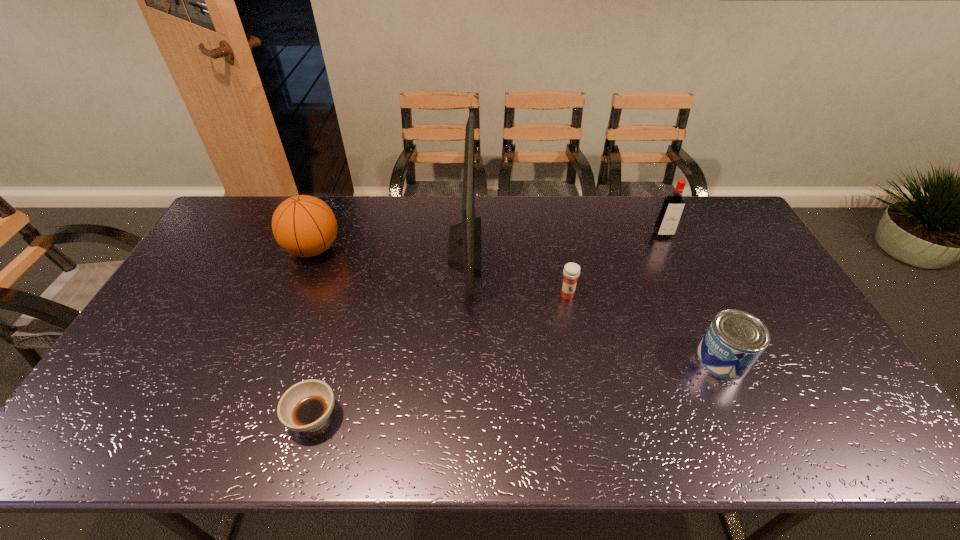
The height and width of the screenshot is (540, 960). In the image, there is a desktop. Find the location of `free space at the far edge`. free space at the far edge is located at coordinates click(383, 235).

At what (x,y) coordinates should I click in order to perform the action: click on free space at the near edge of the desktop. Please return your answer as a coordinate pair (x, y). Looking at the image, I should click on (396, 428).

Image resolution: width=960 pixels, height=540 pixels. I want to click on vacant region at the right edge, so click(x=772, y=281).

The height and width of the screenshot is (540, 960). I want to click on free space at the far left corner, so click(x=243, y=224).

I want to click on free space at the near left corner, so click(x=112, y=429).

At what (x,y) coordinates should I click in order to perform the action: click on free spot at the far right corner of the desktop. Please return your answer as a coordinate pair (x, y). The height and width of the screenshot is (540, 960). Looking at the image, I should click on (745, 234).

Locate an element on the screen. free space between the shortest object and the vodka is located at coordinates (489, 326).

At what (x,y) coordinates should I click in order to perform the action: click on vacant region between the can and the vodka. Please return your answer as a coordinate pair (x, y). The height and width of the screenshot is (540, 960). Looking at the image, I should click on (692, 296).

The image size is (960, 540). What are the coordinates of `free space between the third object from left to right and the basketball` in the screenshot? It's located at (389, 247).

In order to click on free space between the fourth object from right to left and the medicine in this screenshot , I will do `click(516, 271)`.